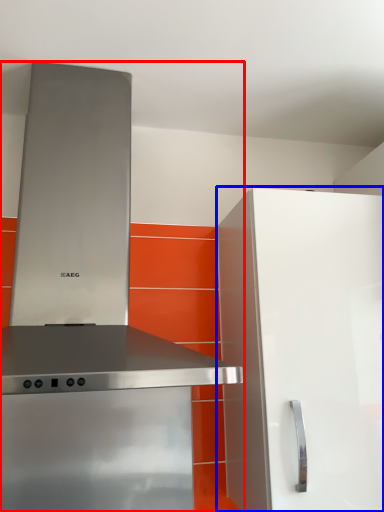
Question: Among these objects, which one is nearest to the camera, home appliance (highlighted by a red box) or cabinetry (highlighted by a blue box)?

Choices:
 (A) home appliance
 (B) cabinetry

Answer: (A)